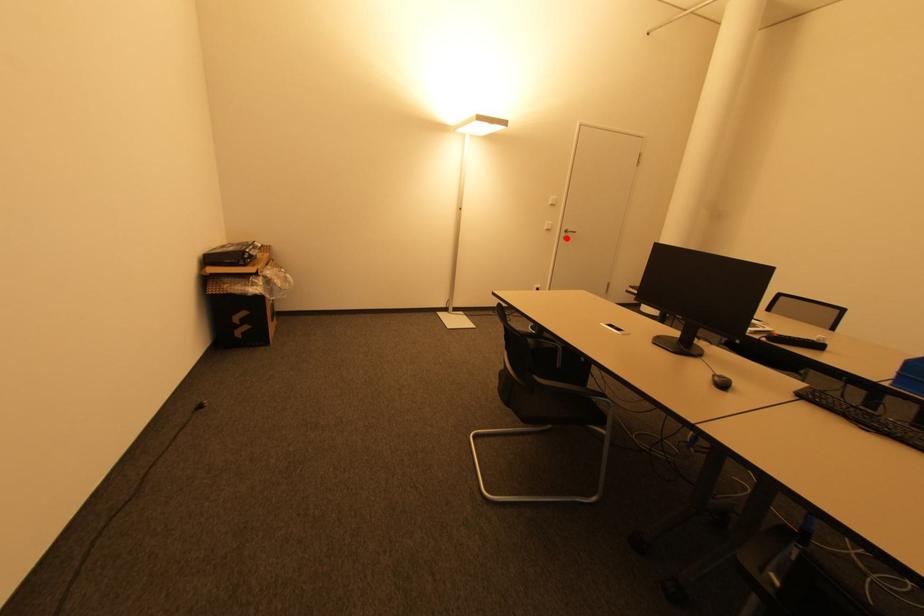
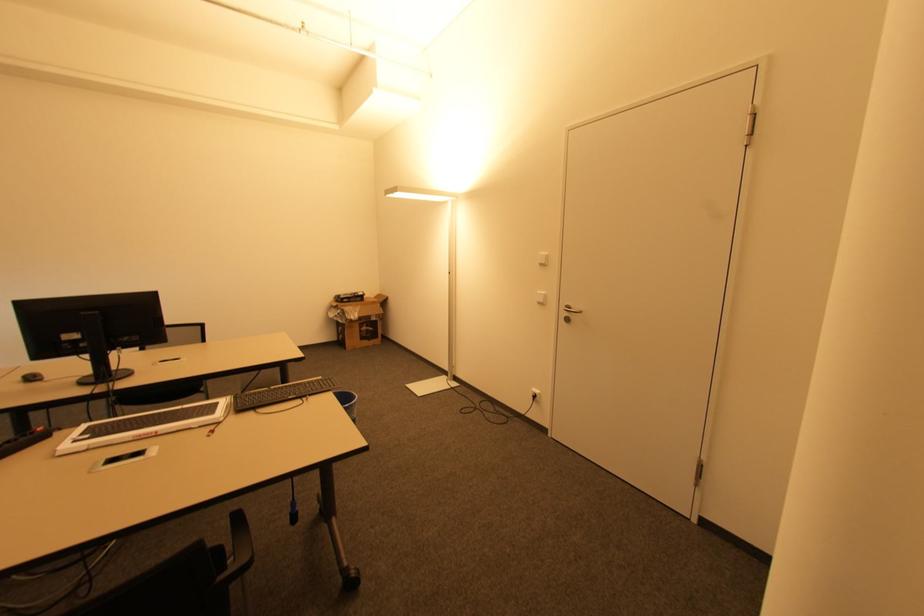
Find the pixel in the second image that matches the highlighted location in the first image.

(568, 320)